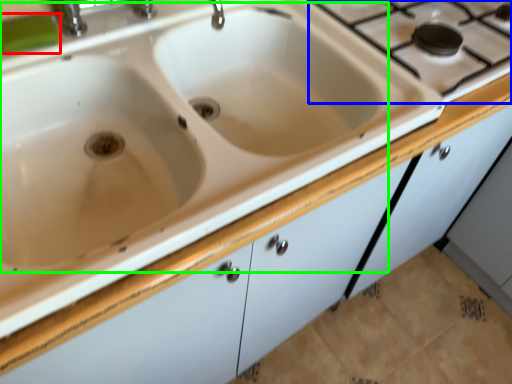
Question: Estimate the real-world distances between objects in this image. Which object is closer to soap (highlighted by a red box), gas stove (highlighted by a blue box) or sink (highlighted by a green box)?

Choices:
 (A) gas stove
 (B) sink

Answer: (B)